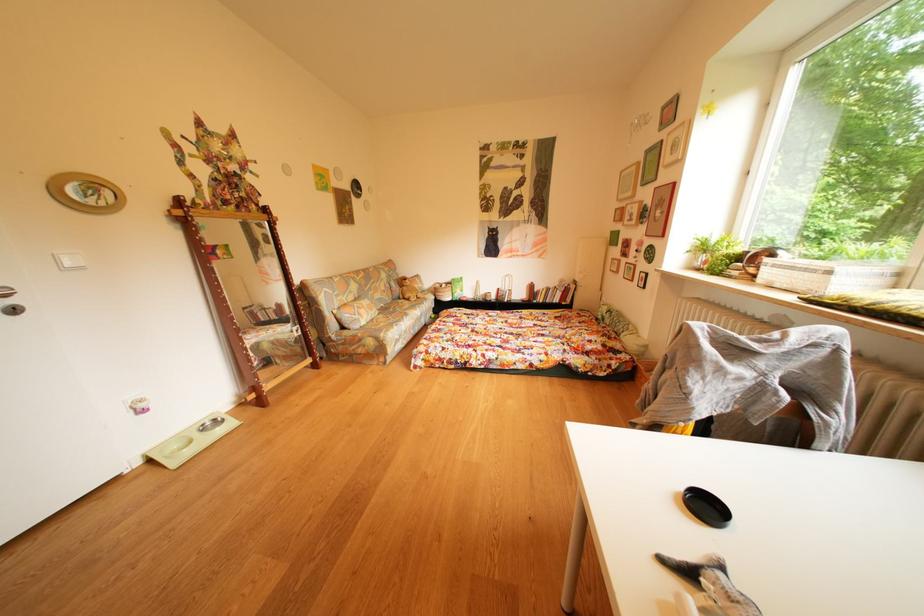
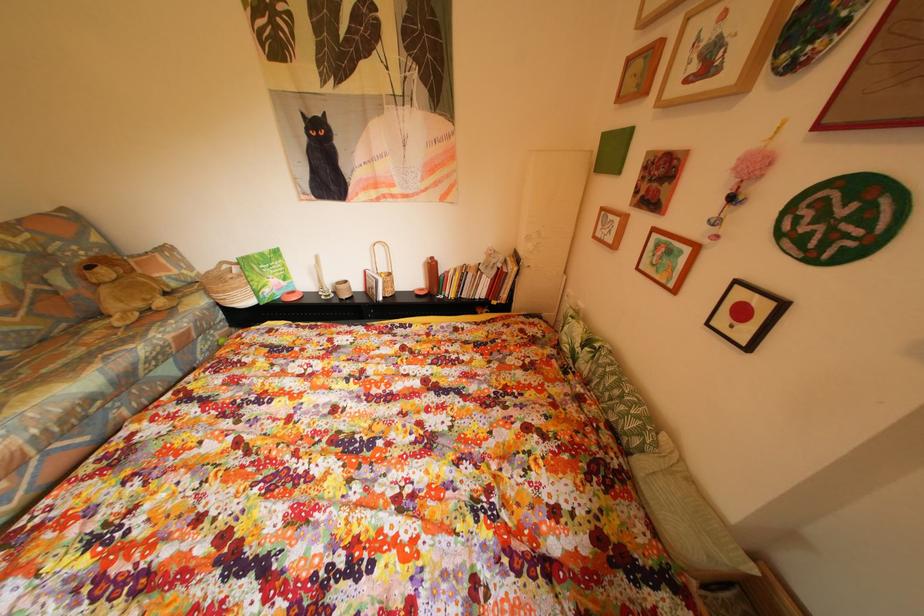
What movement of the cameraman would produce the second image?

The cameraman moved toward right, forward.